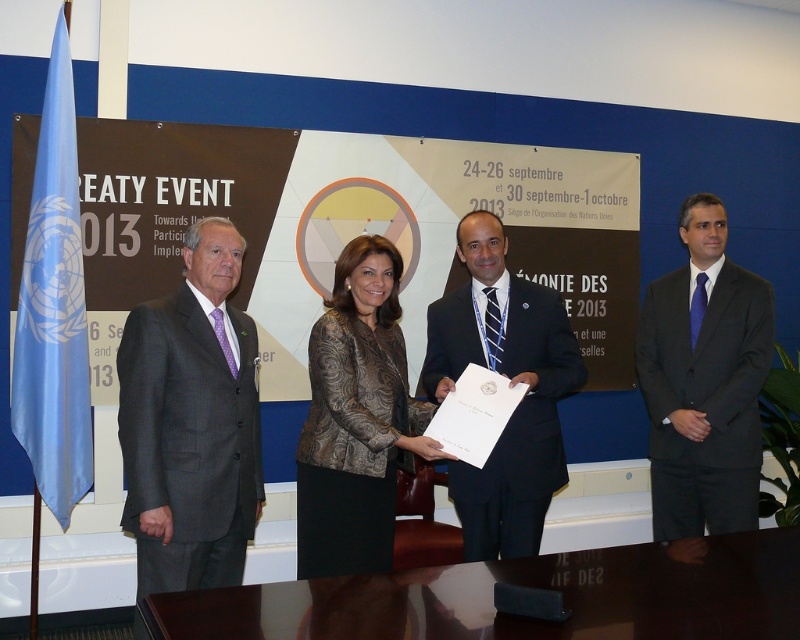
Based on the photo, can you confirm if dark gray suit at left is thinner than blue satin flag at left?

In fact, dark gray suit at left might be wider than blue satin flag at left.

Which is above, dark gray suit at left or blue satin flag at left?

blue satin flag at left is higher up.

Does point (134, 388) come closer to viewer compared to point (56, 93)?

Yes.

This screenshot has height=640, width=800. I want to click on dark gray suit at left, so click(192, 422).

Which of these two, dark blue suit at center or metallic patterned jacket at center, stands shorter?

With less height is metallic patterned jacket at center.

Between dark blue suit at center and metallic patterned jacket at center, which one appears on the left side from the viewer's perspective?

metallic patterned jacket at center is more to the left.

This screenshot has width=800, height=640. I want to click on dark blue suit at center, so click(704, 381).

Locate an element on the screen. The height and width of the screenshot is (640, 800). dark blue suit at center is located at coordinates (704, 381).

Does dark gray suit at left lie in front of matte black suit at center?

Yes, dark gray suit at left is closer to the viewer.

From the picture: Who is more distant from viewer, (222, 392) or (474, 218)?

Point (474, 218)

Who is more distant from viewer, [166,296] or [494,445]?

The point [494,445] is more distant.

Identify the location of dark gray suit at left. This screenshot has width=800, height=640. point(192,422).